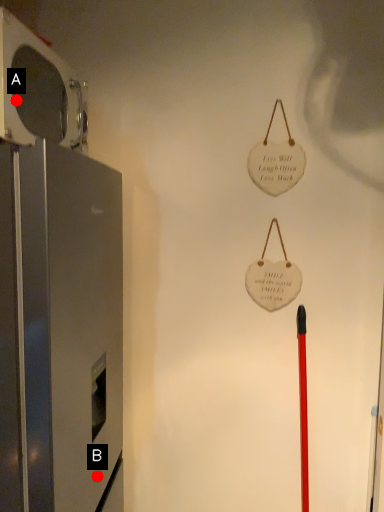
Question: Two points are circled on the image, labeled by A and B beside each circle. Which of the following is the closest to the observer?

Choices:
 (A) A is closer
 (B) B is closer

Answer: (A)